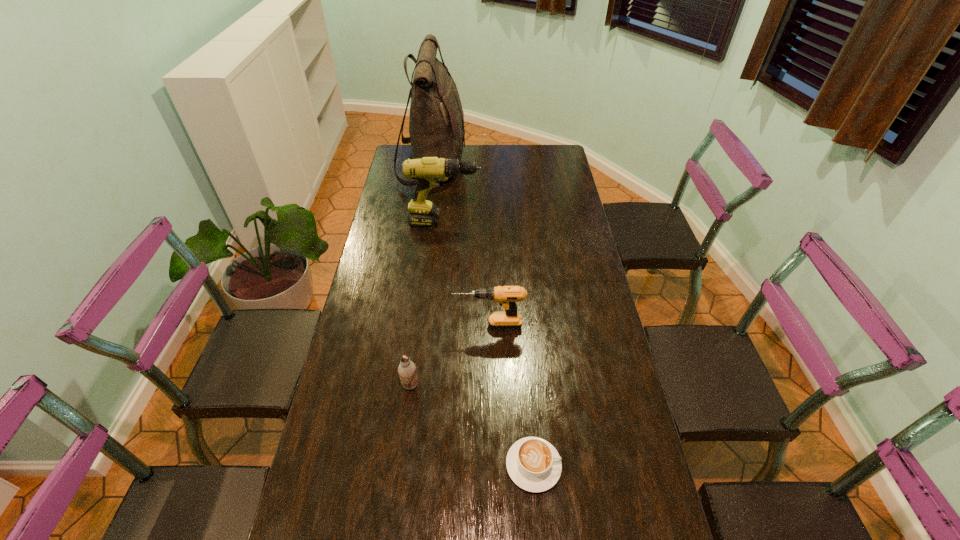
The width and height of the screenshot is (960, 540). Find the location of `free point located 0.310m on the open flap of the farthest object`. free point located 0.310m on the open flap of the farthest object is located at coordinates (531, 167).

Image resolution: width=960 pixels, height=540 pixels. I want to click on vacant space located on the handle side of the fourth shortest object, so click(500, 222).

You are a GUI agent. You are given a task and a screenshot of the screen. Output one action in this format:
    pyautogui.click(x=<x>, y=<y>)
    Task: Click on the vacant space situated at the tip of the third shortest object
    
    Given the screenshot: What is the action you would take?
    pyautogui.click(x=403, y=326)

You are a GUI agent. You are given a task and a screenshot of the screen. Output one action in this format:
    pyautogui.click(x=<x>, y=<y>)
    Task: Click on the vacant space located 0.120m at the tip of the third shortest object
    The height and width of the screenshot is (540, 960).
    Given the screenshot: What is the action you would take?
    pyautogui.click(x=416, y=326)

I want to click on free space located 0.140m at the tip of the third shortest object, so click(410, 326).

Where is `blank space located on the back of the second shortest object`? The height and width of the screenshot is (540, 960). blank space located on the back of the second shortest object is located at coordinates (423, 284).

At what (x,y) coordinates should I click in order to perform the action: click on free space located 0.070m on the side of the cappuccino with the handle. Please return your answer as a coordinate pair (x, y). Image resolution: width=960 pixels, height=540 pixels. Looking at the image, I should click on (588, 465).

Where is `object present at the far edge`? The height and width of the screenshot is (540, 960). object present at the far edge is located at coordinates (436, 121).

Identify the location of backpack present at the left edge. (436, 121).

At what (x,y) coordinates should I click in order to perform the action: click on drill located at the left edge. Please return your answer as a coordinate pair (x, y). Looking at the image, I should click on (428, 171).